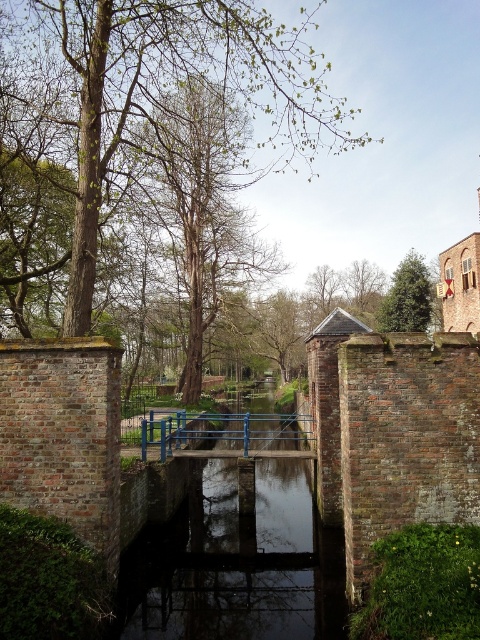
You are standing in front of the canal and want to take a photo of the green leafy tree at upper left. The camera you are using has a maximum focus range of 30 feet. Will you be able to capture the tree clearly in your photo?

The green leafy tree at upper left is 35.78 feet away from the camera, which exceeds the maximum focus range of 30 feet. Therefore, you won not be able to capture the tree clearly in your photo.

You are an architect designing a new pathway between the green textured tree at upper right and the green leafy tree at upper center. Based on their widths, which tree requires more space to accommodate its spread?

The green textured tree at upper right might require more space to accommodate its spread since it might be wider than the green leafy tree at upper center.